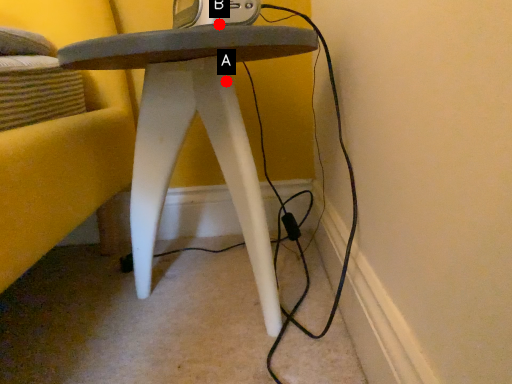
Question: Two points are circled on the image, labeled by A and B beside each circle. Which point is closer to the camera?

Choices:
 (A) A is closer
 (B) B is closer

Answer: (B)